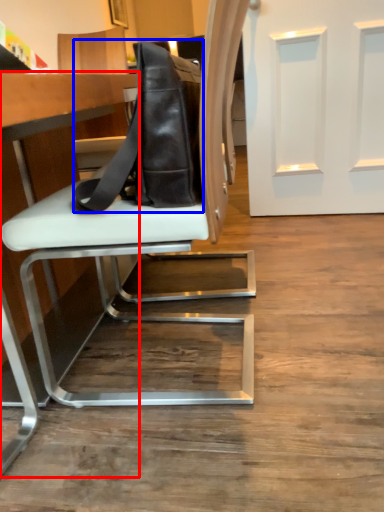
Question: Among these objects, which one is farthest to the camera, table (highlighted by a red box) or messenger bag (highlighted by a blue box)?

Choices:
 (A) table
 (B) messenger bag

Answer: (B)